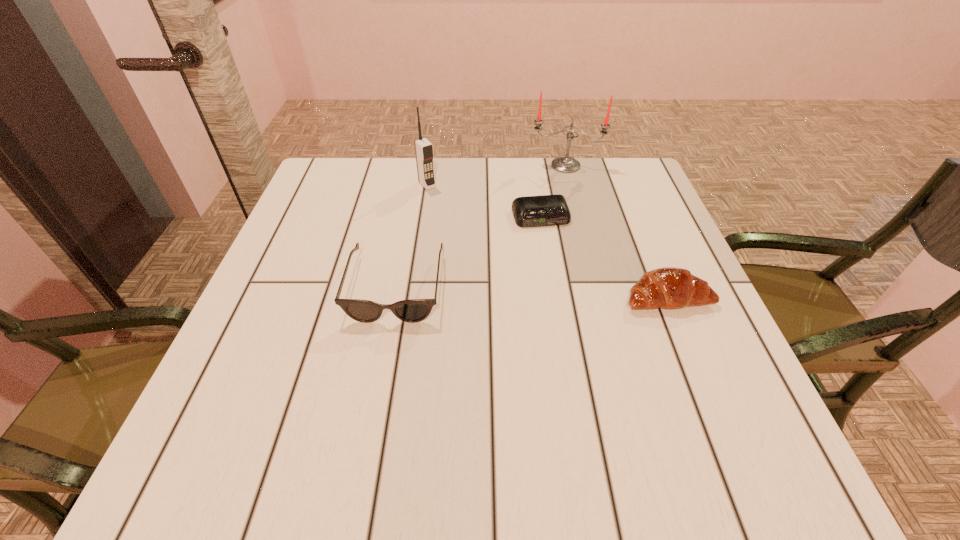
This screenshot has height=540, width=960. I want to click on the fourth closest object to the sunglasses, so click(565, 164).

The height and width of the screenshot is (540, 960). In order to click on free spot that satisfies the following two spatial constraints: 1. on the front lenses of the sunglasses; 2. on the left side of the crescent roll in this screenshot , I will do coord(395,298).